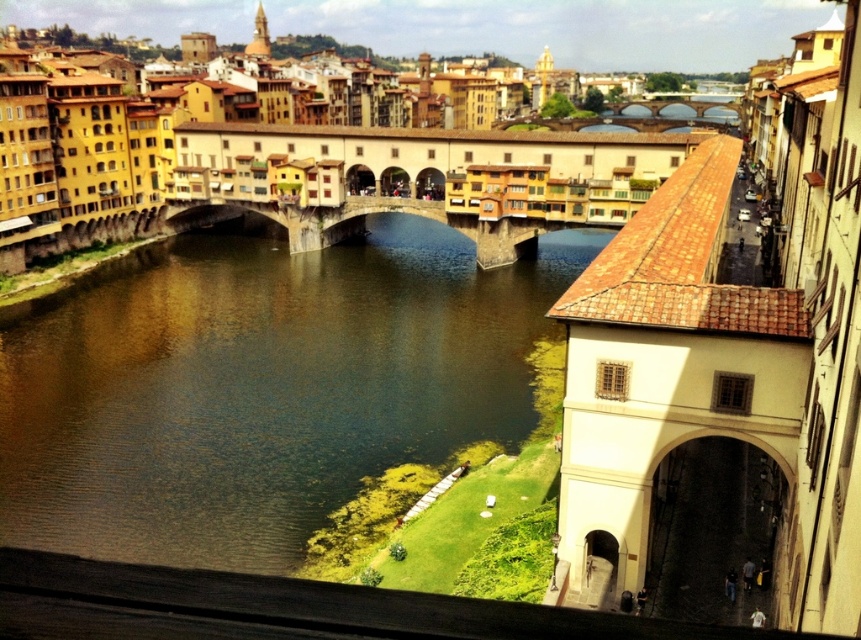
Question: Is the position of brown water at center more distant than that of stone bridge at center?

Choices:
 (A) yes
 (B) no

Answer: (B)

Question: Which of the following is the farthest from the observer?

Choices:
 (A) stone bridge at center
 (B) brown water at center

Answer: (A)

Question: Which point is farther to the camera?

Choices:
 (A) (327, 444)
 (B) (271, 209)

Answer: (B)

Question: Can you confirm if brown water at center is smaller than stone bridge at center?

Choices:
 (A) no
 (B) yes

Answer: (A)

Question: Is brown water at center thinner than stone bridge at center?

Choices:
 (A) no
 (B) yes

Answer: (A)